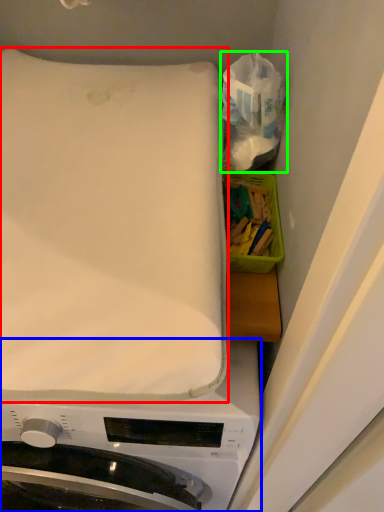
Question: Which is farther away from mattress (highlighted by a red box)? washing machine (highlighted by a blue box) or tissue (highlighted by a green box)?

Choices:
 (A) washing machine
 (B) tissue

Answer: (A)